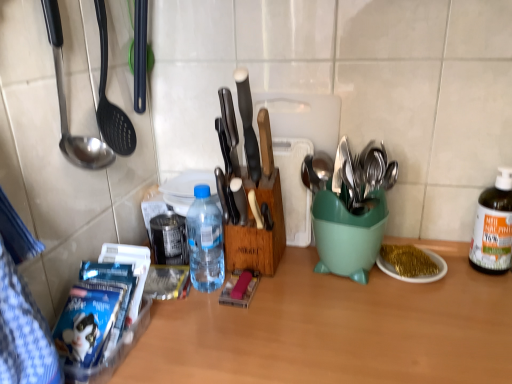
Identify the location of vacant space that is to the left of gold glitter plate at right. This screenshot has width=512, height=384. (332, 287).